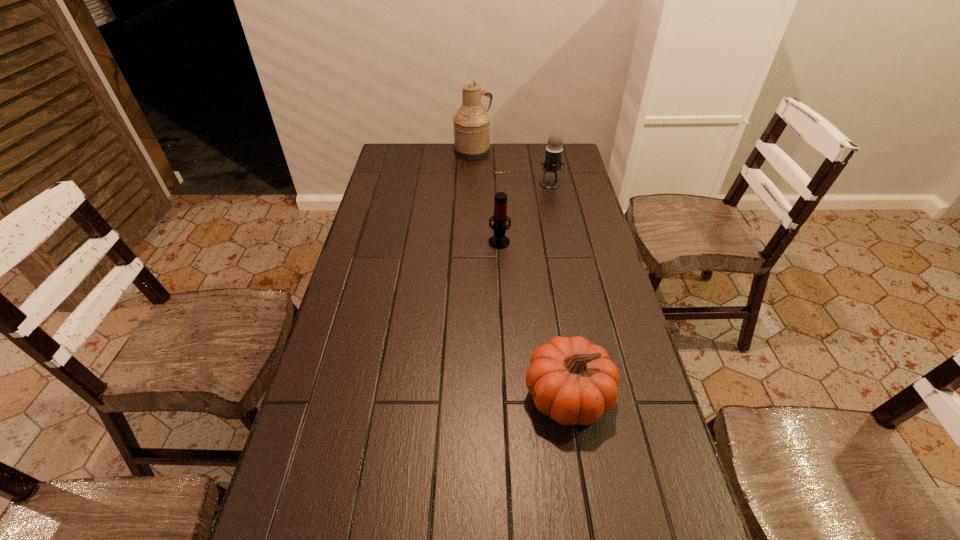
Point out which object is positioned as the third nearest to the second farthest object. Please provide its 2D coordinates. Your answer should be formatted as a tuple, i.e. [(x, y)], where the tuple contains the x and y coordinates of a point satisfying the conditions above.

[(571, 380)]

Where is `the closest microphone relative to the nearest object`? The height and width of the screenshot is (540, 960). the closest microphone relative to the nearest object is located at coordinates (499, 241).

Locate an element on the screen. This screenshot has height=540, width=960. microphone that is the second nearest to the tallest object is located at coordinates (499, 241).

At what (x,y) coordinates should I click in order to perform the action: click on vacant region that satisfies the following two spatial constraints: 1. on the front side of the nearer microphone; 2. on the left side of the farthest object. Please return your answer as a coordinate pair (x, y). Looking at the image, I should click on (471, 240).